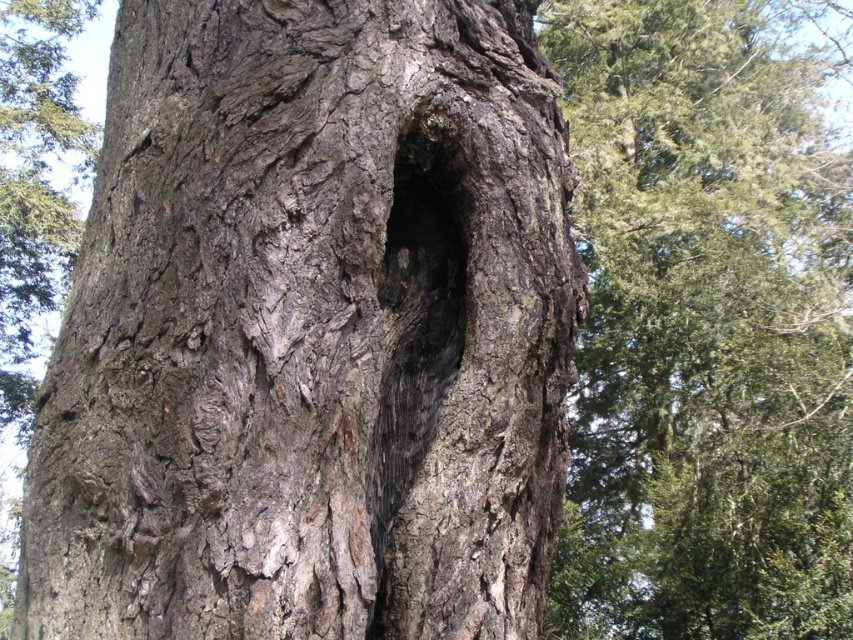
You are a park ranger examining the tree trunk. You notice the dark gray rough bark at center and the dark wood hole at center. Which feature is physically nearer to your eyes when observing the tree?

The dark gray rough bark at center is closer to the viewer than the dark wood hole at center, so the dark gray rough bark at center is physically nearer to your eyes when observing the tree.

You are a woodpecker looking for a place to nest. You see the dark gray rough bark at center and the dark wood hole at center. Which one is closer to you?

The dark wood hole at center is closer to you because it is only 9.79 inches away from the dark gray rough bark at center, but since both are at the center, the hole is likely positioned in front of the bark, making it closer.

You are a hiker trying to identify two types of tree trunks in the image. Which one is closer to you, the dark gray rough bark at center or the smooth bark tree trunk at center?

The dark gray rough bark at center is closer to the viewer than the smooth bark tree trunk at center.